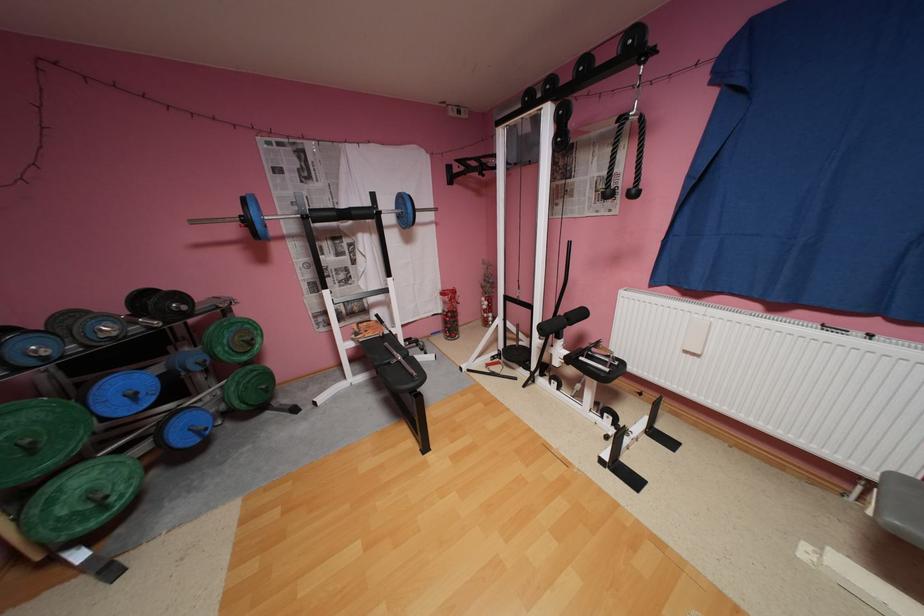
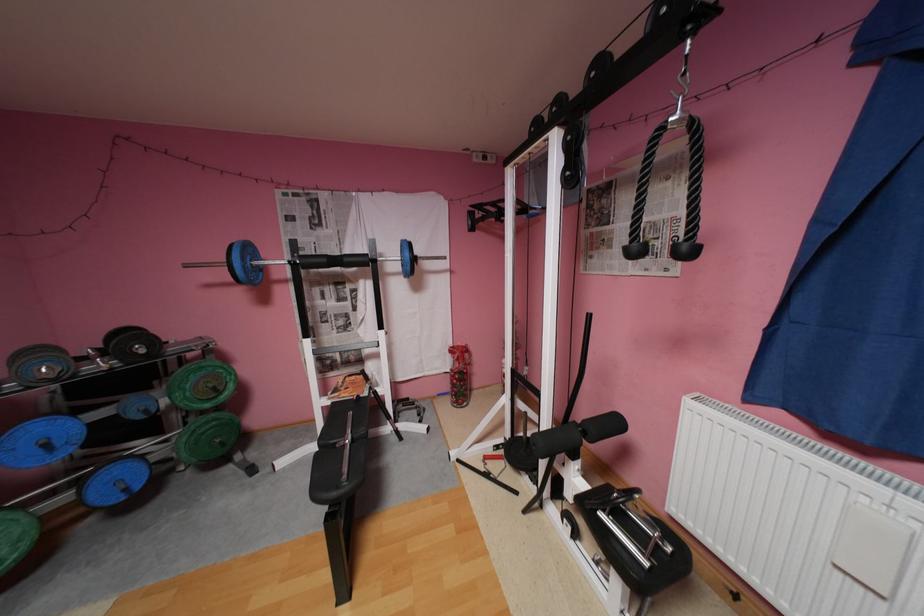
In the second image, find the point that corresponds to the point at 193,308 in the first image.

(152, 351)